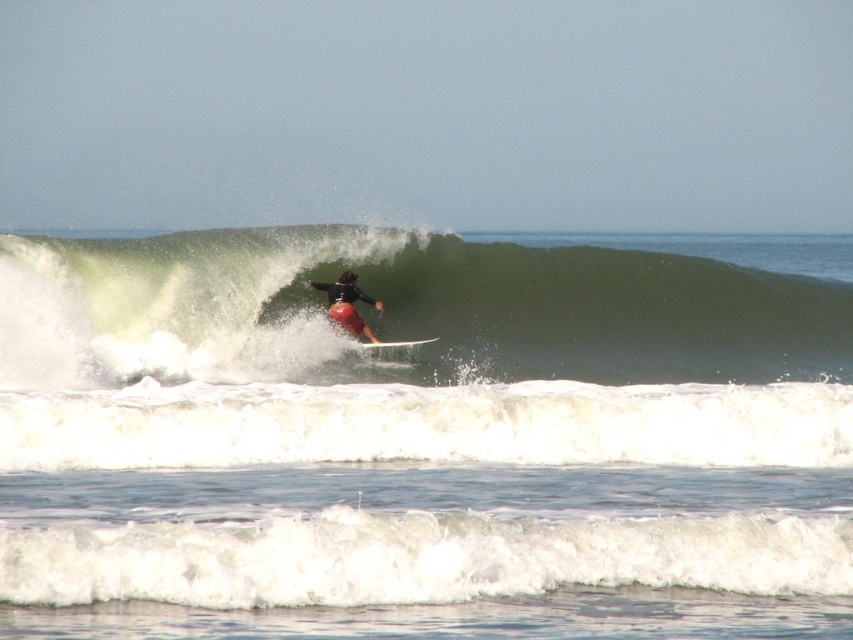
Question: Considering the real-world distances, which object is closest to the matte black wetsuit at center?

Choices:
 (A) green rubber wave at center
 (B) white glossy surfboard at center

Answer: (B)

Question: Can you confirm if green rubber wave at center is positioned to the left of matte black wetsuit at center?

Choices:
 (A) yes
 (B) no

Answer: (B)

Question: Which object is positioned closest to the green rubber wave at center?

Choices:
 (A) matte black wetsuit at center
 (B) white glossy surfboard at center

Answer: (A)

Question: Which of the following is the farthest from the observer?

Choices:
 (A) green rubber wave at center
 (B) white glossy surfboard at center
 (C) matte black wetsuit at center

Answer: (C)

Question: Does green rubber wave at center have a larger size compared to matte black wetsuit at center?

Choices:
 (A) no
 (B) yes

Answer: (B)

Question: Does green rubber wave at center lie in front of matte black wetsuit at center?

Choices:
 (A) yes
 (B) no

Answer: (A)